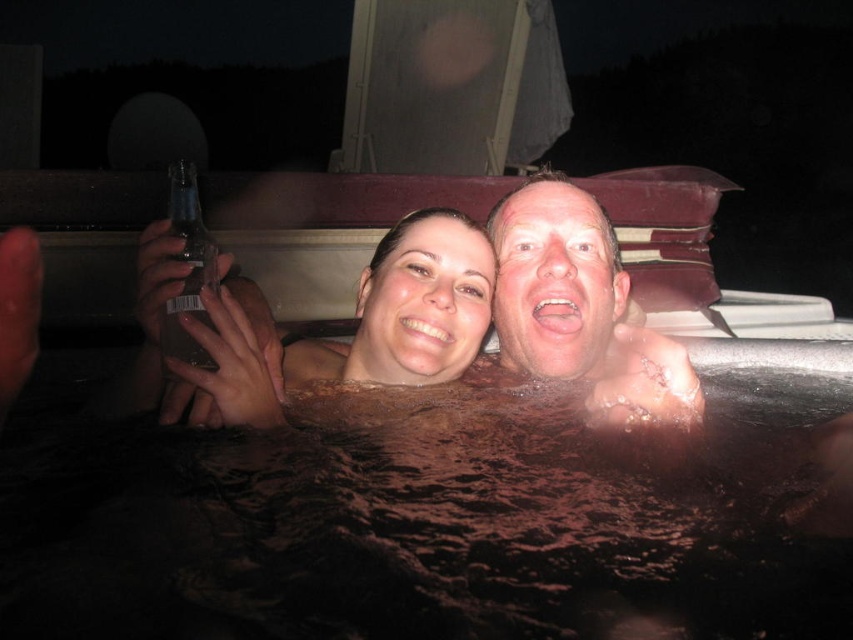
Question: Does brown plastic tub at center appear on the left side of clear glass bottle at left?

Choices:
 (A) yes
 (B) no

Answer: (B)

Question: Which object appears closest to the camera in this image?

Choices:
 (A) smooth skin couple at center
 (B) clear glass bottle at left
 (C) brown plastic tub at center

Answer: (C)

Question: Is brown plastic tub at center positioned at the back of clear glass bottle at left?

Choices:
 (A) yes
 (B) no

Answer: (B)

Question: Which object is positioned closest to the smooth skin couple at center?

Choices:
 (A) smooth skin face at center
 (B) clear glass bottle at left

Answer: (A)

Question: Is brown plastic tub at center closer to the viewer compared to smooth skin face at center?

Choices:
 (A) yes
 (B) no

Answer: (A)

Question: Considering the real-world distances, which object is farthest from the clear glass bottle at left?

Choices:
 (A) smooth skin couple at center
 (B) brown plastic tub at center
 (C) smooth skin face at center

Answer: (C)